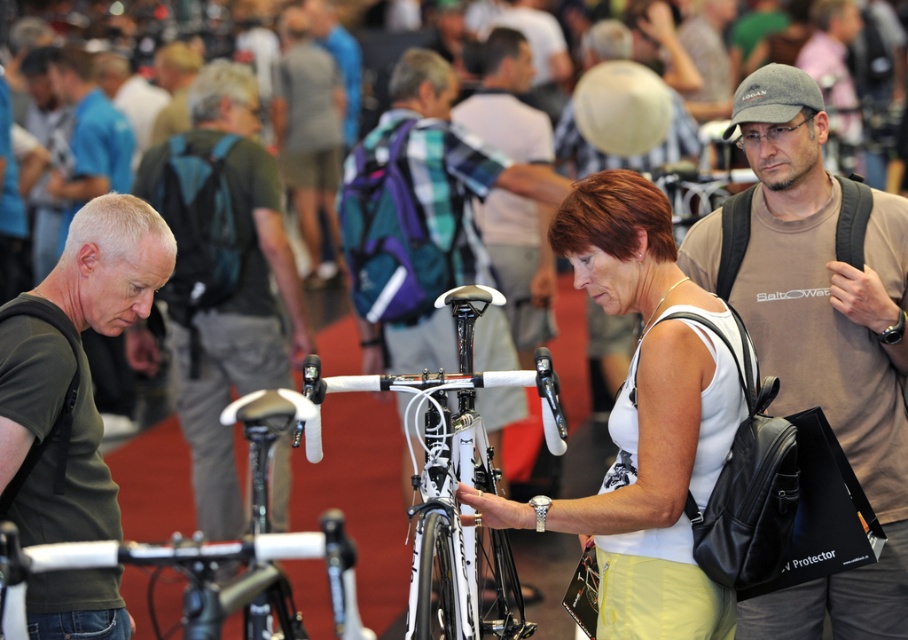
Who is shorter, white glossy bicycle at center or white matte bicycle handlebars at center?

white matte bicycle handlebars at center

Can you confirm if white glossy bicycle at center is thinner than white matte bicycle handlebars at center?

No, white glossy bicycle at center is not thinner than white matte bicycle handlebars at center.

Locate an element on the screen. The image size is (908, 640). white glossy bicycle at center is located at coordinates (457, 481).

Can you confirm if brown cotton t-shirt at center-right is thinner than white glossy bicycle at center?

Yes.

Is brown cotton t-shirt at center-right positioned behind white glossy bicycle at center?

Yes, brown cotton t-shirt at center-right is behind white glossy bicycle at center.

Does point (812, 340) come farther from viewer compared to point (558, 406)?

Yes.

Where is `brown cotton t-shirt at center-right`? This screenshot has width=908, height=640. brown cotton t-shirt at center-right is located at coordinates (825, 342).

Is brown cotton t-shirt at center-right to the left of dark green t-shirt at left from the viewer's perspective?

In fact, brown cotton t-shirt at center-right is to the right of dark green t-shirt at left.

Which of these two, brown cotton t-shirt at center-right or dark green t-shirt at left, stands shorter?

dark green t-shirt at left

Describe the element at coordinates (825, 342) in the screenshot. I see `brown cotton t-shirt at center-right` at that location.

You are a GUI agent. You are given a task and a screenshot of the screen. Output one action in this format:
    pyautogui.click(x=<x>, y=<y>)
    Task: Click on the brown cotton t-shirt at center-right
    The image size is (908, 640).
    Given the screenshot: What is the action you would take?
    pyautogui.click(x=825, y=342)